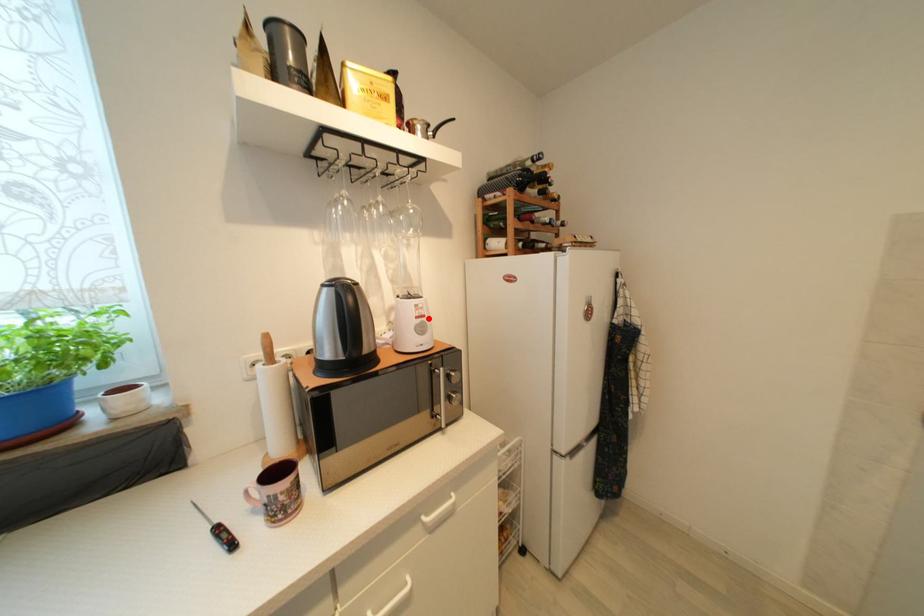
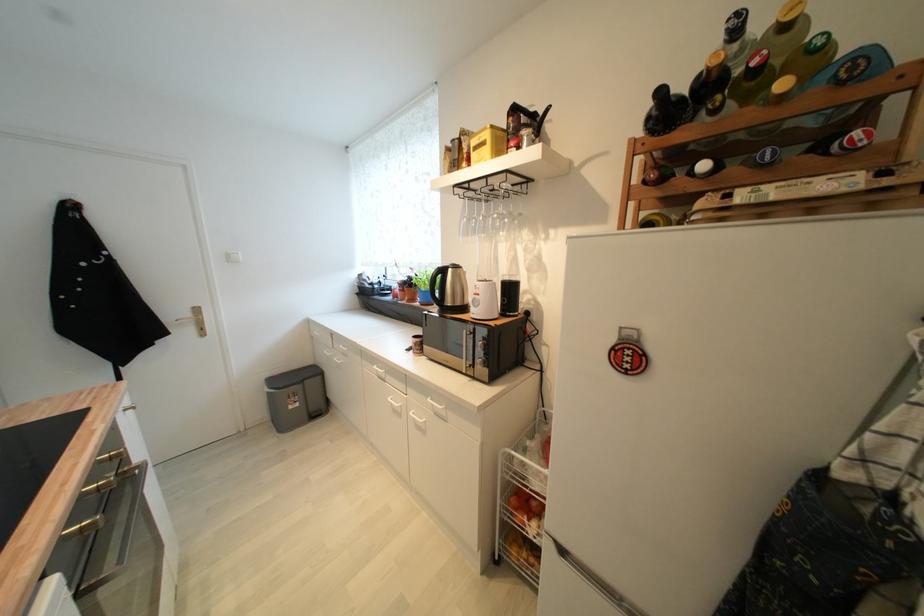
The point at the highlighted location is marked in the first image. Where is the corresponding point in the second image?

(483, 296)